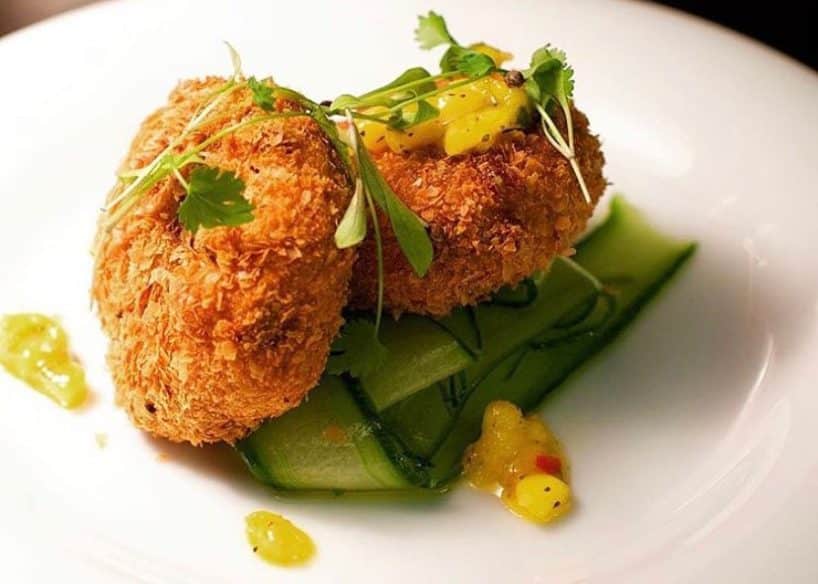
Find the location of a particular element. The height and width of the screenshot is (584, 818). glimpse of table is located at coordinates (780, 25), (19, 6).